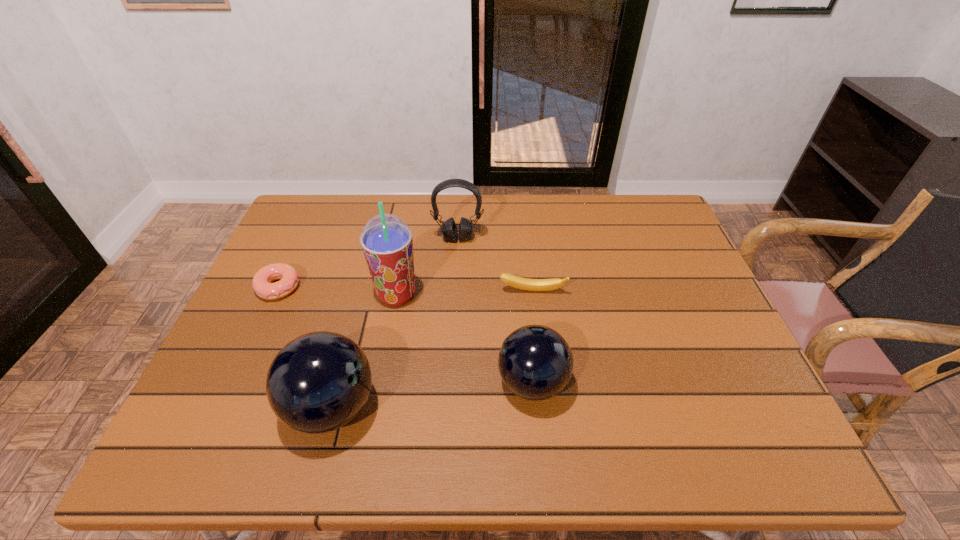
Locate an element on the screen. This screenshot has width=960, height=540. the left bowling ball is located at coordinates (318, 382).

Identify the location of the fourth tallest object. The width and height of the screenshot is (960, 540). (535, 362).

Image resolution: width=960 pixels, height=540 pixels. I want to click on the shorter bowling ball, so click(x=535, y=362).

Locate an element on the screen. the farthest object is located at coordinates (449, 229).

Locate an element on the screen. This screenshot has height=540, width=960. headset is located at coordinates (449, 229).

This screenshot has height=540, width=960. In order to click on smoothie in this screenshot , I will do `click(386, 240)`.

Find the location of a particular element. The width and height of the screenshot is (960, 540). the leftmost object is located at coordinates (289, 278).

Find the location of a particular element. The width and height of the screenshot is (960, 540). the shortest object is located at coordinates (289, 278).

This screenshot has width=960, height=540. Identify the location of banana. (514, 281).

This screenshot has height=540, width=960. Find the location of `free spot located 0.370m on the side of the taller bowling ball with the finger holes`. free spot located 0.370m on the side of the taller bowling ball with the finger holes is located at coordinates (549, 407).